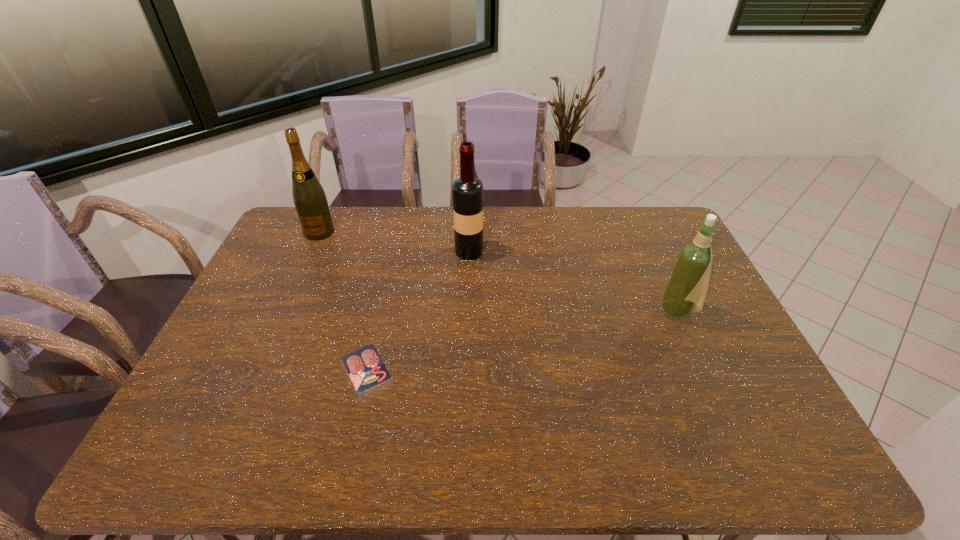
Find the location of a particular element. the second nearest wine bottle is located at coordinates (467, 191).

Locate an element on the screen. the second wine bottle from right to left is located at coordinates (467, 191).

The height and width of the screenshot is (540, 960). What are the coordinates of `the leftmost wine bottle` in the screenshot? It's located at (310, 201).

The height and width of the screenshot is (540, 960). In order to click on the leftmost object in this screenshot , I will do `click(310, 201)`.

Identify the location of the rightmost wine bottle. (688, 284).

Find the location of a particular element. This screenshot has height=540, width=960. the rightmost object is located at coordinates (688, 284).

Locate an element on the screen. the shortest object is located at coordinates (365, 367).

Find the location of a particular element. The height and width of the screenshot is (540, 960). the nearest object is located at coordinates (365, 367).

You are a GUI agent. You are given a task and a screenshot of the screen. Output one action in this format:
    pyautogui.click(x=<x>, y=<y>)
    Task: Click on the vacant region located 0.260m on the left of the second wine bottle from right to left
    
    Given the screenshot: What is the action you would take?
    pyautogui.click(x=380, y=251)

Find the location of a particular element. The width and height of the screenshot is (960, 540). blank space located on the front-facing side of the farthest wine bottle is located at coordinates (278, 322).